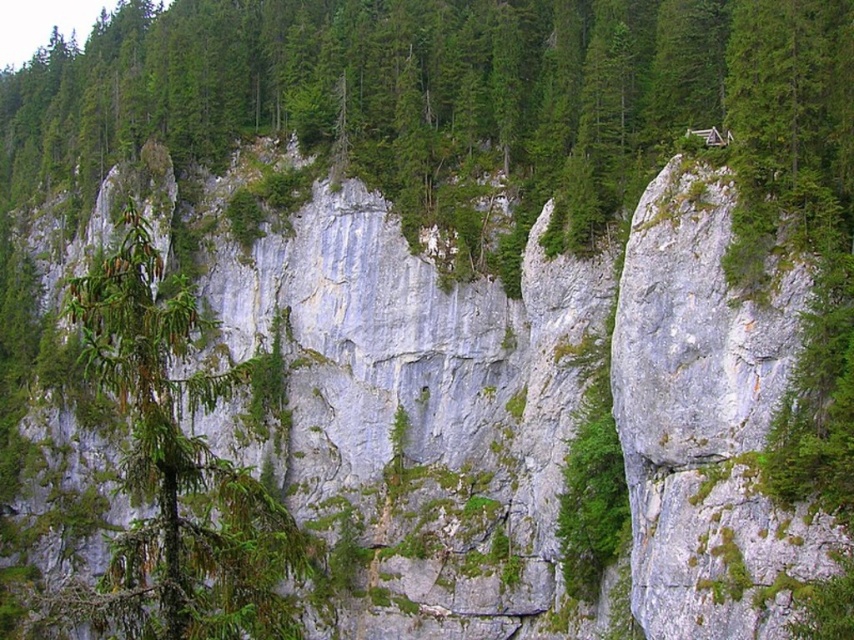
Question: Is green matte tree at center to the left of green matte tree at left from the viewer's perspective?

Choices:
 (A) no
 (B) yes

Answer: (B)

Question: Which point is closer to the camera?

Choices:
 (A) green matte tree at center
 (B) green matte tree at left

Answer: (B)

Question: Considering the relative positions of green matte tree at center and green matte tree at left in the image provided, where is green matte tree at center located with respect to green matte tree at left?

Choices:
 (A) above
 (B) below

Answer: (A)

Question: Among these points, which one is nearest to the camera?

Choices:
 (A) (235, 605)
 (B) (487, 224)

Answer: (A)

Question: Which object is closer to the camera taking this photo?

Choices:
 (A) green matte tree at center
 (B) green matte tree at left

Answer: (B)

Question: Is green matte tree at center bigger than green matte tree at left?

Choices:
 (A) yes
 (B) no

Answer: (A)